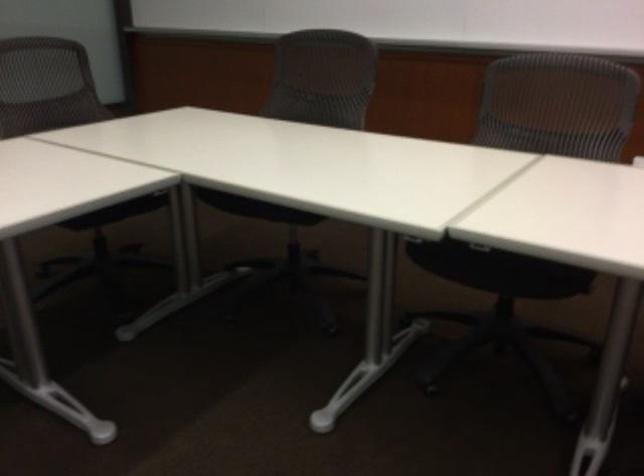
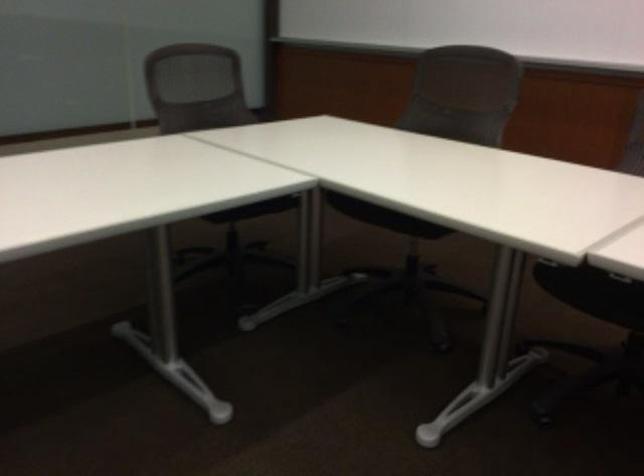
The point at (x=258, y=207) is marked in the first image. Where is the corresponding point in the second image?

(384, 216)